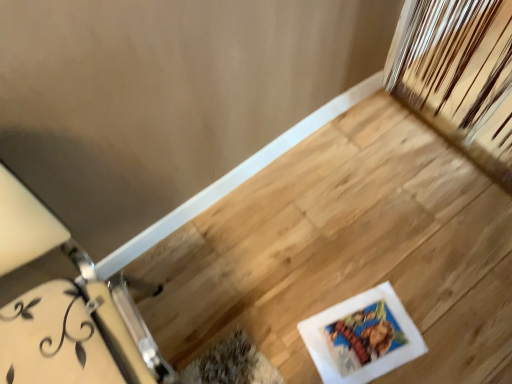
Question: Is white glossy picture frame at lower right wider or thinner than white painted wood table at left?

Choices:
 (A) wide
 (B) thin

Answer: (B)

Question: From a real-world perspective, is white glossy picture frame at lower right physically located above or below white painted wood table at left?

Choices:
 (A) below
 (B) above

Answer: (A)

Question: Based on their sizes in the image, would you say white glossy picture frame at lower right is bigger or smaller than white painted wood table at left?

Choices:
 (A) big
 (B) small

Answer: (B)

Question: Is white painted wood table at left inside or outside of white glossy picture frame at lower right?

Choices:
 (A) inside
 (B) outside

Answer: (B)

Question: Considering the positions of point (95, 307) and point (402, 309), is point (95, 307) closer or farther from the camera than point (402, 309)?

Choices:
 (A) closer
 (B) farther

Answer: (A)

Question: From their relative heights in the image, would you say white painted wood table at left is taller or shorter than white glossy picture frame at lower right?

Choices:
 (A) tall
 (B) short

Answer: (A)

Question: In terms of width, does white painted wood table at left look wider or thinner when compared to white glossy picture frame at lower right?

Choices:
 (A) wide
 (B) thin

Answer: (A)